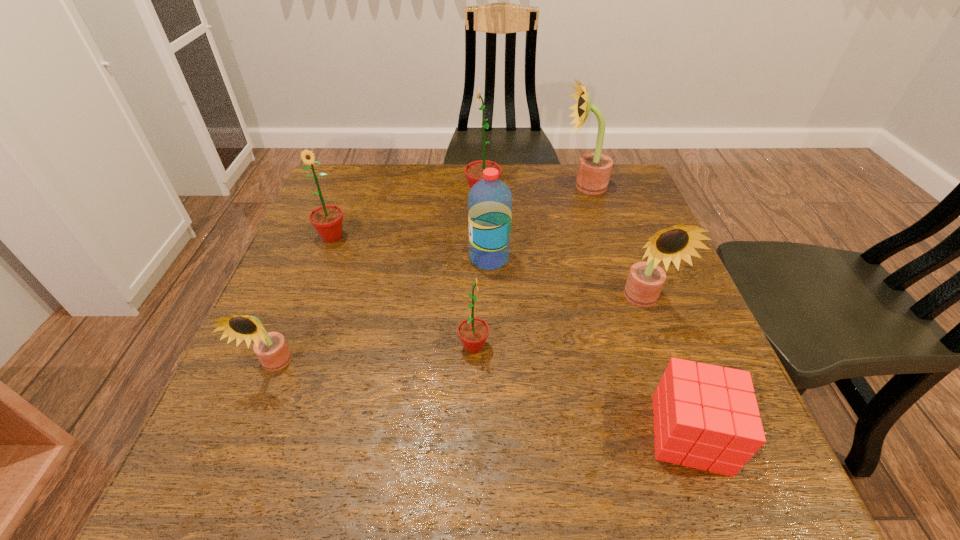
Where is `vacant space at the far edge of the desktop`? Image resolution: width=960 pixels, height=540 pixels. vacant space at the far edge of the desktop is located at coordinates (551, 182).

In the image, there is a desktop. Identify the location of free region at the near edge. This screenshot has width=960, height=540. (652, 471).

Image resolution: width=960 pixels, height=540 pixels. I want to click on vacant space at the left edge of the desktop, so click(x=301, y=313).

In order to click on blank space at the right edge in this screenshot , I will do `click(618, 246)`.

What are the coordinates of `vacant space at the far left corner of the desktop` in the screenshot? It's located at (373, 195).

The width and height of the screenshot is (960, 540). What are the coordinates of `vacant region at the near left corner of the desktop` in the screenshot? It's located at (199, 463).

Locate an element on the screen. The image size is (960, 540). vacant space at the far right corner of the desktop is located at coordinates (618, 190).

Locate an element on the screen. This screenshot has height=540, width=960. unoccupied area between the second smallest yellow sunflower and the smallest green sunflower is located at coordinates (558, 323).

This screenshot has height=540, width=960. I want to click on vacant area that lies between the farthest green sunflower and the nearest green sunflower, so click(x=478, y=272).

Identify the location of free space between the fourth farthest sunflower and the biggest green sunflower. (563, 248).